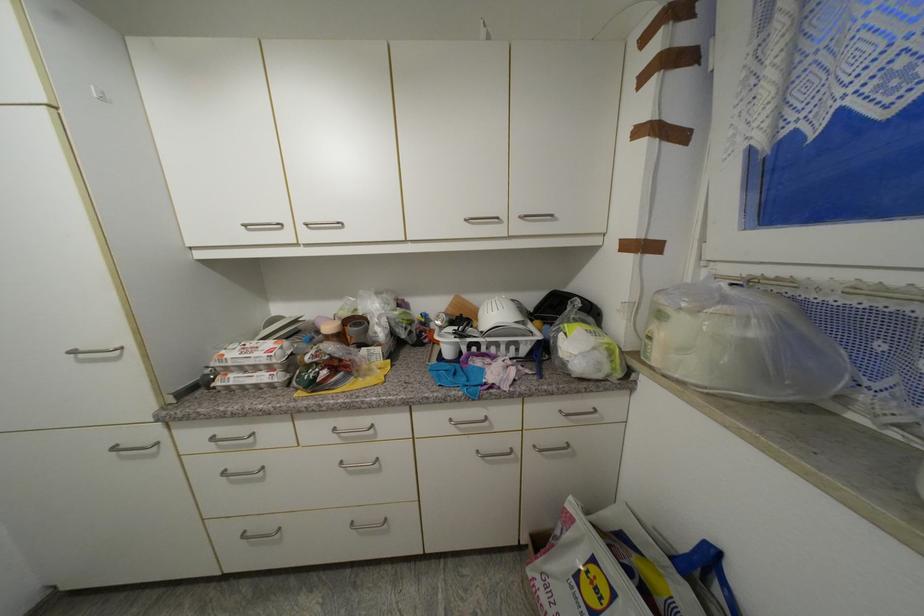
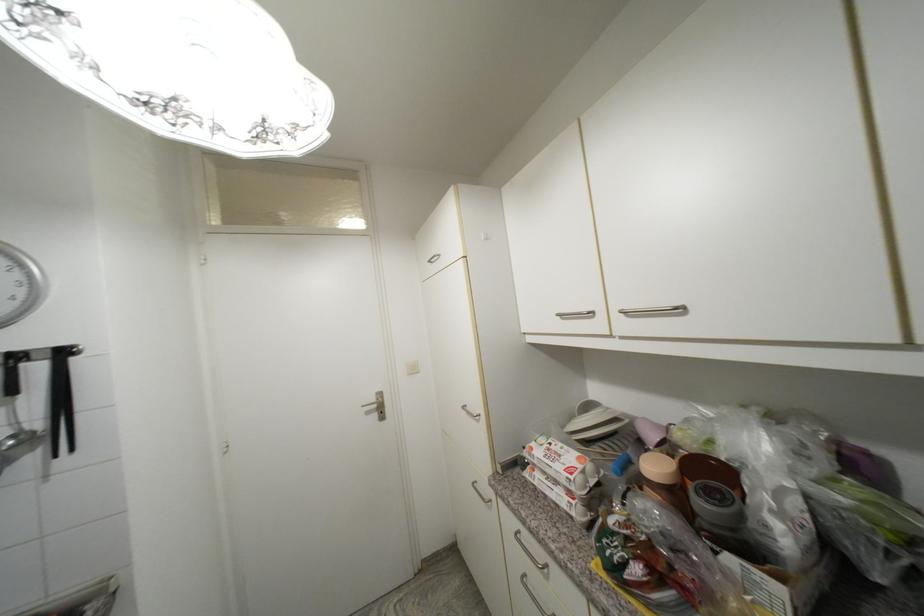
The point at [228,357] is marked in the first image. Where is the corresponding point in the second image?

(537, 451)